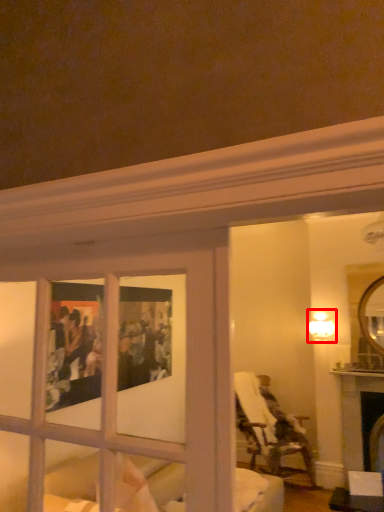
Question: Considering the relative positions of light fixture (annotated by the red box) and chair in the image provided, where is light fixture (annotated by the red box) located with respect to the staircase?

Choices:
 (A) right
 (B) left

Answer: (A)